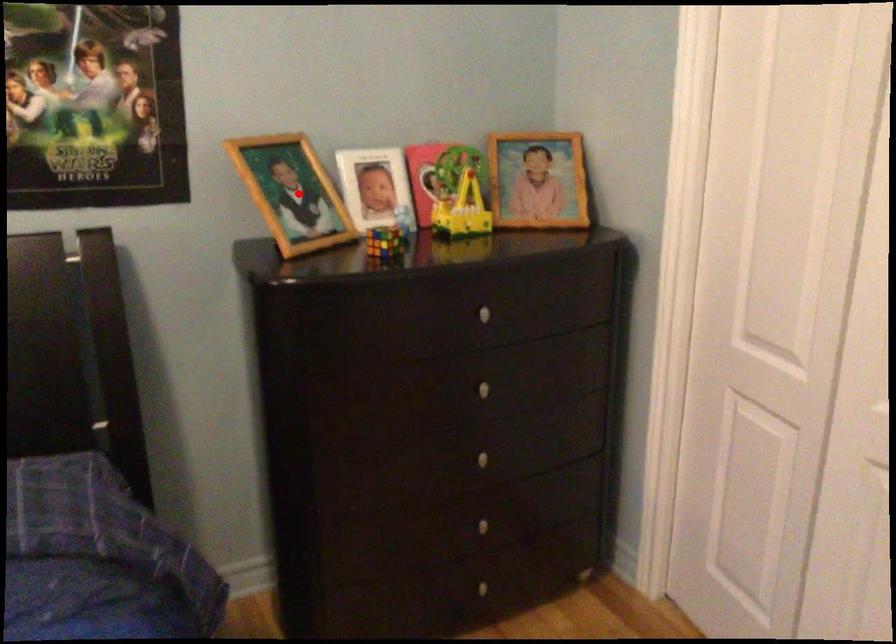
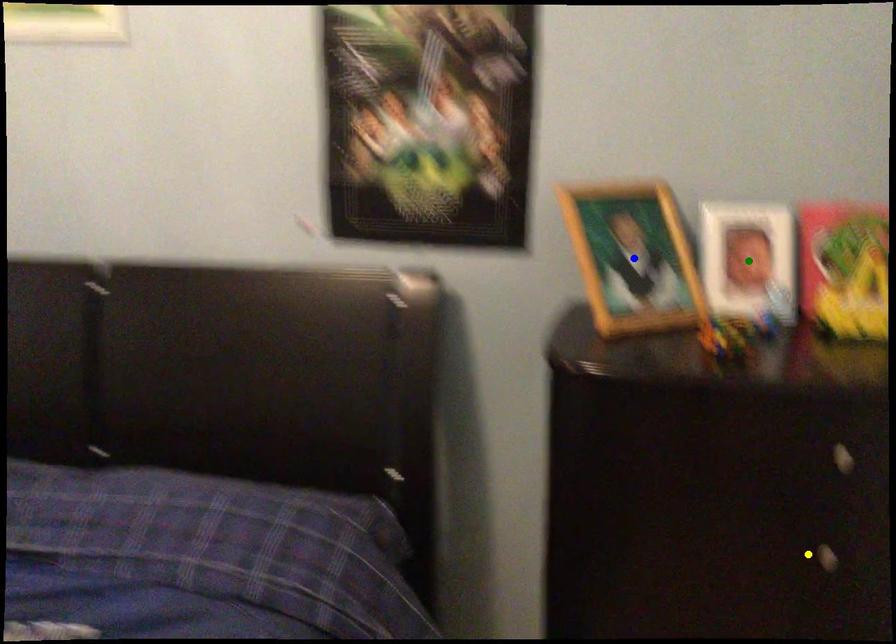
Question: I am providing you with two images of the same scene from different viewpoints. A red point is marked on the first image. You are given multiple points on the second image. Can you choose the point in image 2 that corresponds to the point in image 1?

Choices:
 (A) yellow point
 (B) green point
 (C) blue point

Answer: (C)